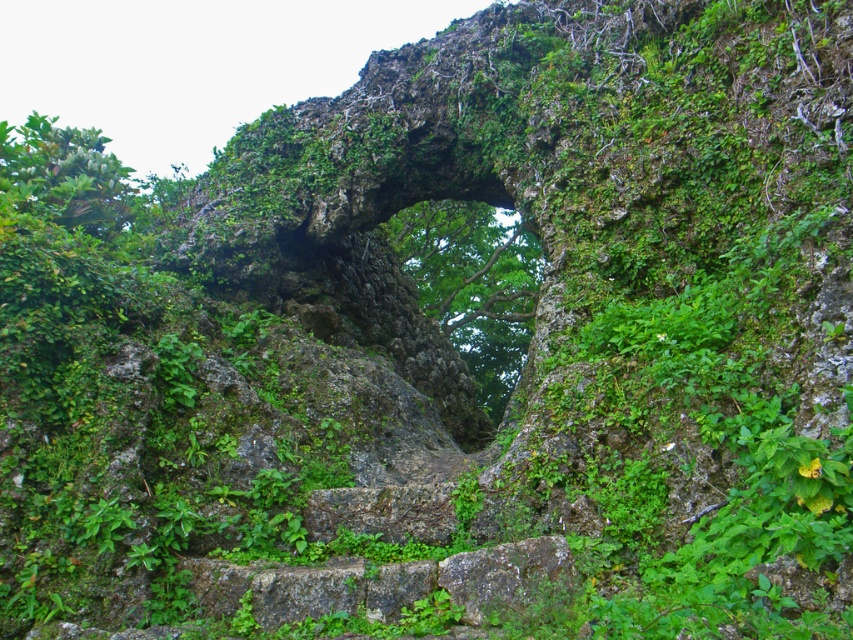
Does green leafy tree at center have a lesser height compared to green leafy tree at upper left?

Yes, green leafy tree at center is shorter than green leafy tree at upper left.

Who is shorter, green leafy tree at center or green leafy tree at upper left?

green leafy tree at center is shorter.

Between point (517, 307) and point (70, 168), which one is positioned behind?

The point (517, 307) is more distant.

In order to click on green leafy tree at center in this screenshot , I will do click(473, 285).